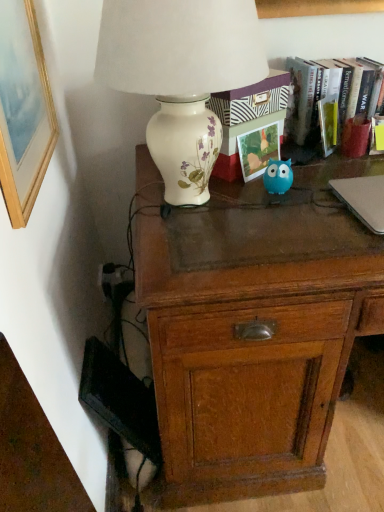
Image resolution: width=384 pixels, height=512 pixels. In order to click on free space between silver metallic laptop at right and blue rubber toy at center in this screenshot , I will do pyautogui.click(x=317, y=204).